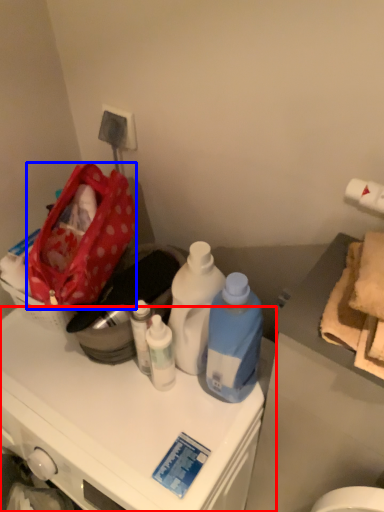
Question: Among these objects, which one is farthest to the camera, cabinetry (highlighted by a red box) or handbag (highlighted by a blue box)?

Choices:
 (A) cabinetry
 (B) handbag

Answer: (B)